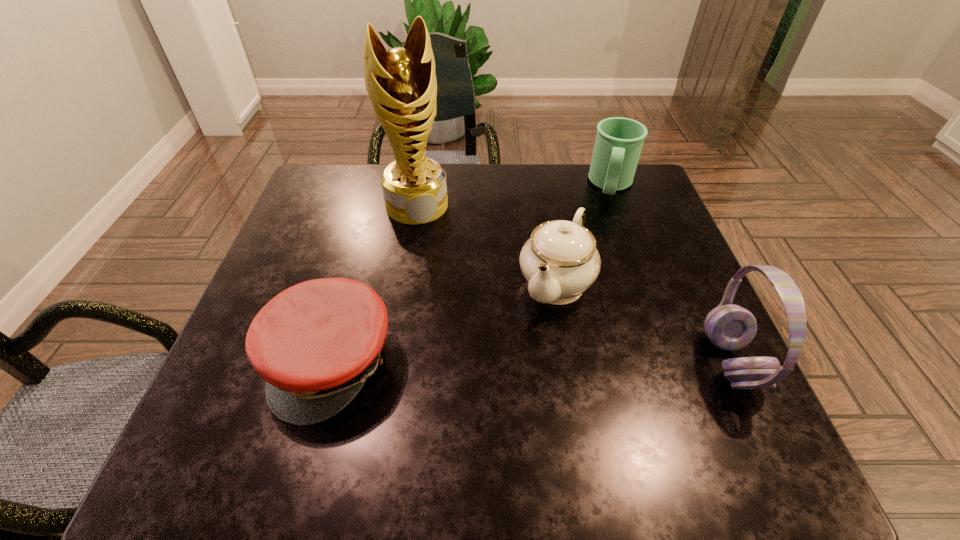
Where is `vacant space at the right edge of the desktop`? vacant space at the right edge of the desktop is located at coordinates (709, 352).

This screenshot has width=960, height=540. I want to click on vacant space at the far left corner of the desktop, so click(x=332, y=205).

I want to click on free space at the far right corner of the desktop, so click(x=629, y=187).

This screenshot has width=960, height=540. What are the coordinates of `vacant area between the chinaware and the tallest object` in the screenshot? It's located at (486, 244).

This screenshot has width=960, height=540. Find the location of `free spot between the tallest object and the mug`. free spot between the tallest object and the mug is located at coordinates (515, 195).

At what (x,y) coordinates should I click in order to perform the action: click on free space between the shortest object and the headset. Please return your answer as a coordinate pair (x, y). The height and width of the screenshot is (540, 960). Looking at the image, I should click on (531, 362).

Identify the location of empty location between the tallest object and the mug. (515, 195).

Locate an element on the screen. This screenshot has height=540, width=960. empty location between the third object from left to right and the cap is located at coordinates (444, 322).

The height and width of the screenshot is (540, 960). I want to click on free point between the mug and the shortest object, so click(472, 274).

Locate an element on the screen. The height and width of the screenshot is (540, 960). free space between the third object from right to left and the headset is located at coordinates (643, 322).